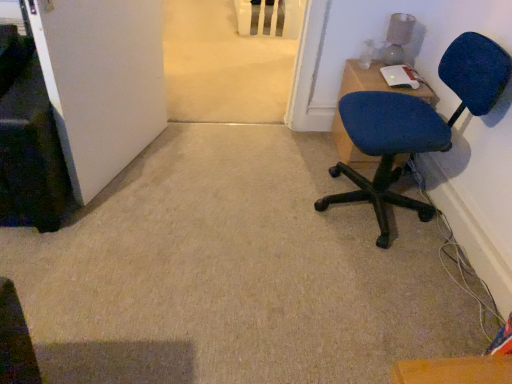
Where is `vacant space in front of blue fabric chair at right`? This screenshot has height=384, width=512. vacant space in front of blue fabric chair at right is located at coordinates (374, 284).